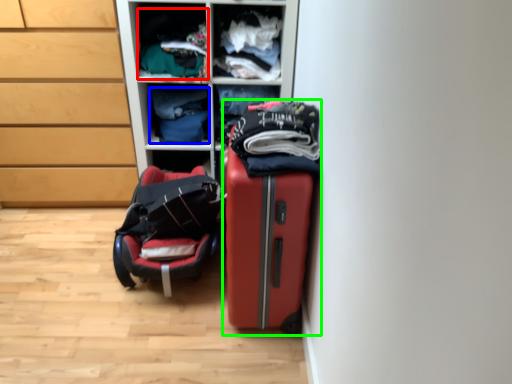
Question: Considering the real-world distances, which object is closest to clothing (highlighted by a red box)? clothing (highlighted by a blue box) or suitcase (highlighted by a green box).

Choices:
 (A) clothing
 (B) suitcase

Answer: (A)